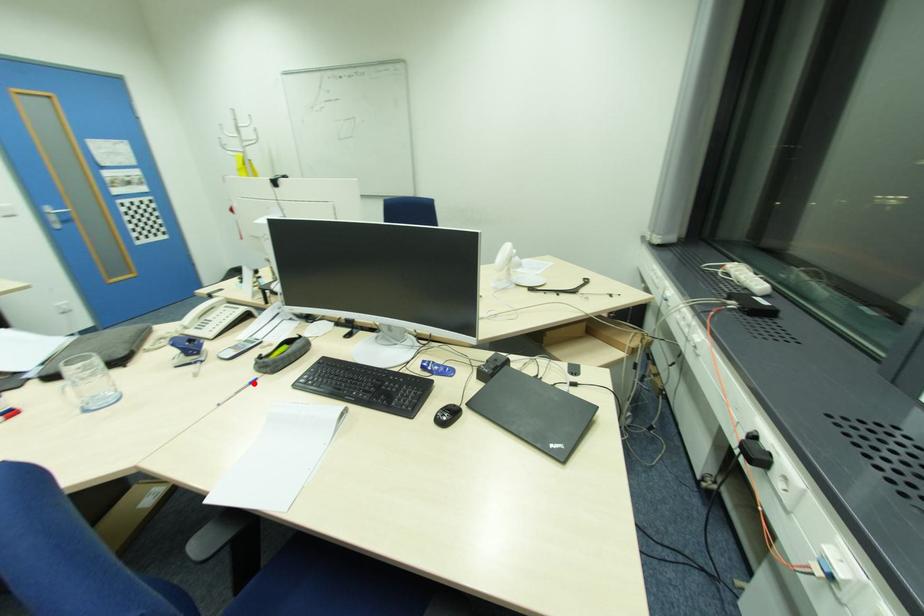
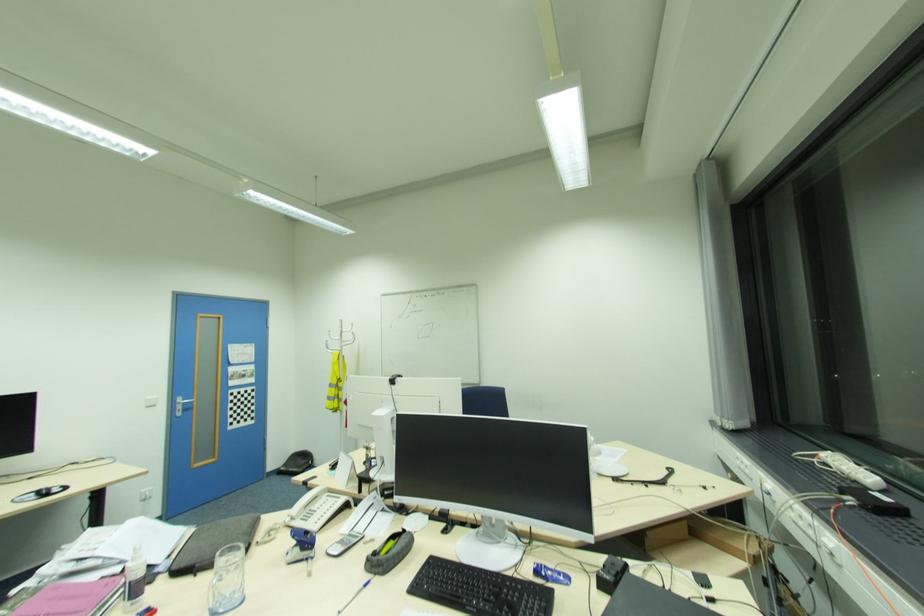
Locate, in the second image, the point that corresponds to the highlighted location in the first image.

(369, 585)